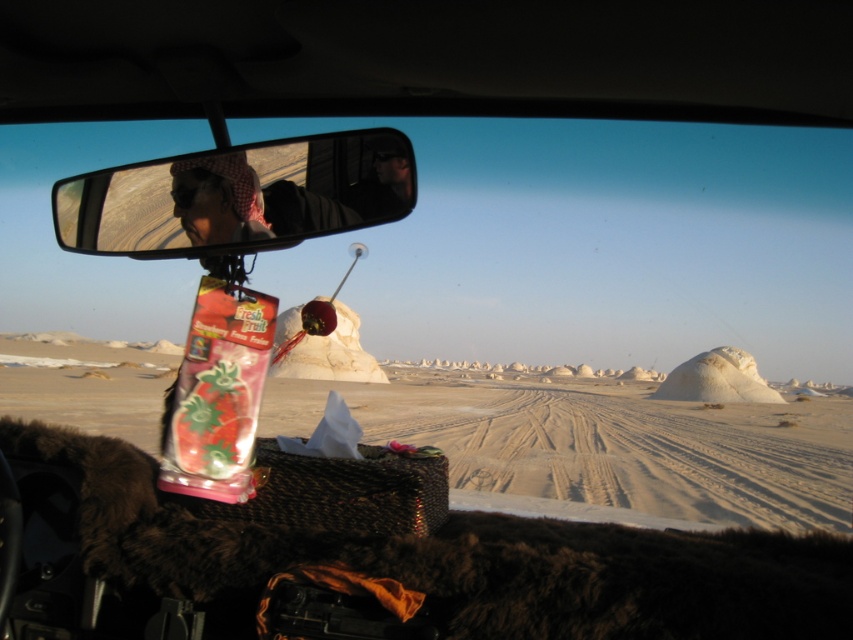
Question: Does white sandy desert at center have a larger size compared to matte black headscarf at upper center?

Choices:
 (A) yes
 (B) no

Answer: (A)

Question: Does white sandy desert at center have a greater width compared to matte black headscarf at upper center?

Choices:
 (A) no
 (B) yes

Answer: (B)

Question: Considering the real-world distances, which object is closest to the clear plastic mirror at upper center?

Choices:
 (A) white sandy desert at center
 (B) matte black headscarf at upper center

Answer: (B)

Question: Which object is closer to the camera taking this photo?

Choices:
 (A) matte black headscarf at upper center
 (B) clear plastic mirror at upper center

Answer: (B)

Question: Based on their relative distances, which object is farther from the white sandy desert at center?

Choices:
 (A) matte black headscarf at upper center
 (B) clear plastic mirror at upper center

Answer: (B)

Question: Can you confirm if white sandy desert at center is positioned below clear plastic mirror at upper center?

Choices:
 (A) no
 (B) yes

Answer: (B)